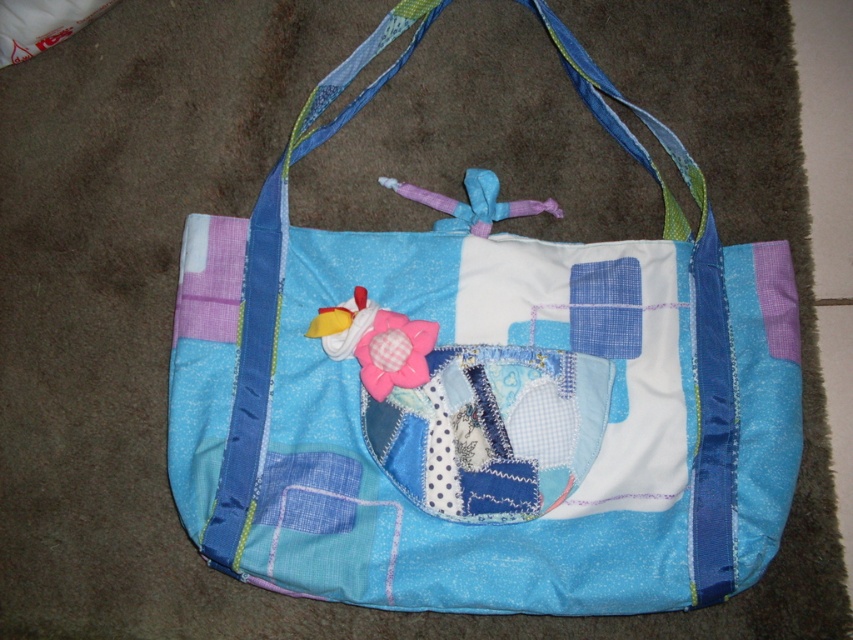
Does patchwork fabric shoulder bag at center have a larger size compared to patchwork fabric pocket at center?

Yes.

Consider the image. Between patchwork fabric shoulder bag at center and patchwork fabric pocket at center, which one has more height?

patchwork fabric shoulder bag at center

Image resolution: width=853 pixels, height=640 pixels. What are the coordinates of `patchwork fabric shoulder bag at center` in the screenshot? It's located at (485, 397).